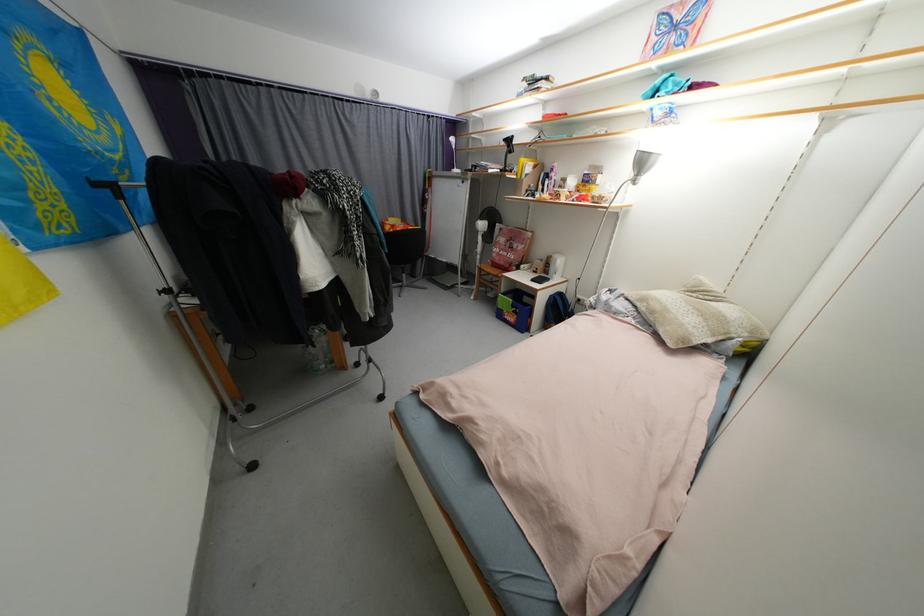
I want to click on silver lamp head, so click(641, 164).